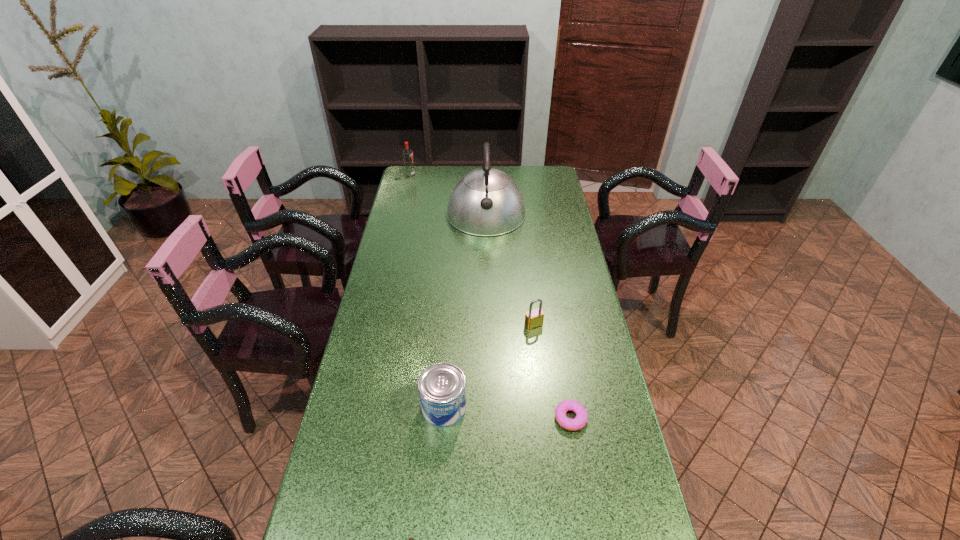
Locate an element on the screen. The width and height of the screenshot is (960, 540). the second farthest object is located at coordinates (485, 202).

This screenshot has height=540, width=960. I want to click on kettle, so click(x=485, y=202).

You are a GUI agent. You are given a task and a screenshot of the screen. Output one action in this format:
    pyautogui.click(x=<x>, y=<y>)
    Task: Click on the fifth shortest object
    The width and height of the screenshot is (960, 540).
    Given the screenshot: What is the action you would take?
    pyautogui.click(x=407, y=155)

Find the location of `vodka`. vodka is located at coordinates (407, 155).

The height and width of the screenshot is (540, 960). Identify the location of can. (442, 387).

Where is `padlock`? padlock is located at coordinates (533, 318).

Where is `doughnut`? doughnut is located at coordinates (579, 422).

Find the location of a particular element. blank area located 0.110m from the spout of the fifth nearest object is located at coordinates (487, 257).

What are the coordinates of `free spot located 0.350m on the front label of the vodka` in the screenshot? It's located at (489, 175).

Locate an element on the screen. This screenshot has width=960, height=540. vacant area situated 0.240m on the front label of the can is located at coordinates (556, 408).